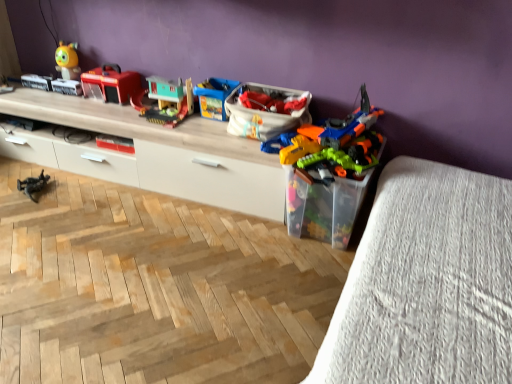
You are a GUI agent. You are given a task and a screenshot of the screen. Output one action in this format:
    pyautogui.click(x=<x>, y=<y>)
    Task: Click on the vacant region under shiny red fire truck at center, the 2th toy in the left-to-right sequence (from a real-world perspective)
    This screenshot has height=384, width=512.
    Given the screenshot: What is the action you would take?
    pyautogui.click(x=106, y=98)